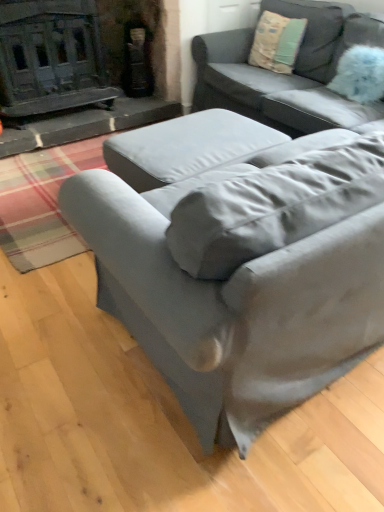
Question: From the image's perspective, is textured beige pillow at upper right positioned above or below blue fluffy pillow at upper right?

Choices:
 (A) above
 (B) below

Answer: (A)

Question: Would you say textured beige pillow at upper right is to the left or to the right of blue fluffy pillow at upper right in the picture?

Choices:
 (A) left
 (B) right

Answer: (A)

Question: Which object is positioned farthest from the textured beige pillow at upper right?

Choices:
 (A) satin gray couch at lower right, which is counted as the 2th studio couch, starting from the back
 (B) blue fluffy pillow at upper right
 (C) satin gray couch at center, the second studio couch when ordered from front to back

Answer: (A)

Question: Estimate the real-world distances between objects in this image. Which object is closer to the satin gray couch at center, the second studio couch when ordered from front to back?

Choices:
 (A) satin gray couch at lower right, which is counted as the 2th studio couch, starting from the back
 (B) textured beige pillow at upper right
 (C) blue fluffy pillow at upper right

Answer: (B)